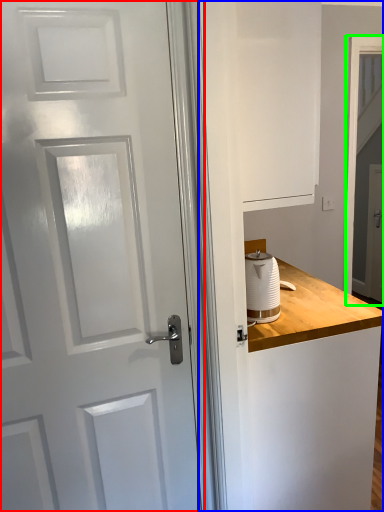
Question: Estimate the real-world distances between objects in this image. Which object is closer to door (highlighted by a red box), dresser (highlighted by a blue box) or screen door (highlighted by a green box)?

Choices:
 (A) dresser
 (B) screen door

Answer: (A)